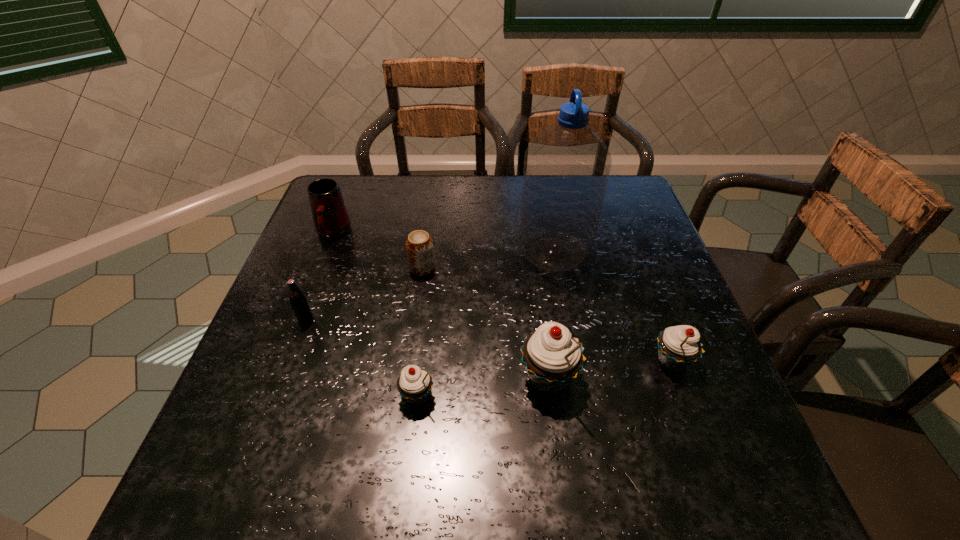
Where is `the leftmost cupcake`? the leftmost cupcake is located at coordinates (414, 384).

At what (x,y) coordinates should I click in order to perform the action: click on the tallest cupcake. Please return your answer as a coordinate pair (x, y). The width and height of the screenshot is (960, 540). Looking at the image, I should click on (552, 358).

Identify the location of the second cupcake from right to left. Image resolution: width=960 pixels, height=540 pixels. (552, 358).

Find the location of a particular element. The width and height of the screenshot is (960, 540). the rightmost object is located at coordinates (678, 346).

Identify the location of the second tallest cupcake. The width and height of the screenshot is (960, 540). (678, 346).

I want to click on water jug, so click(566, 169).

Image resolution: width=960 pixels, height=540 pixels. What are the coordinates of `mug` in the screenshot? It's located at (331, 220).

The width and height of the screenshot is (960, 540). I want to click on beer can, so click(x=419, y=245).

Locate an element on the screen. The width and height of the screenshot is (960, 540). pop is located at coordinates (298, 301).

Where is `blank space located 0.110m on the right of the shortest cupcake`? blank space located 0.110m on the right of the shortest cupcake is located at coordinates (493, 396).